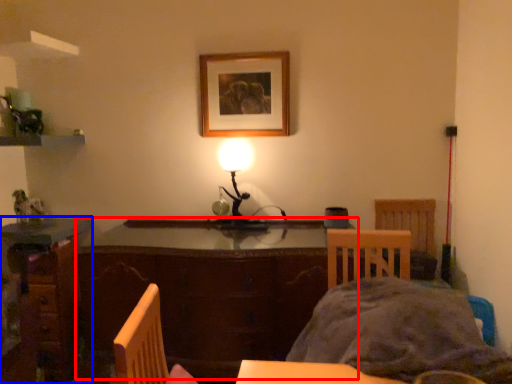
Question: Which of the following is the closest to the observer, table (highlighted by a red box) or desk (highlighted by a blue box)?

Choices:
 (A) table
 (B) desk

Answer: (A)